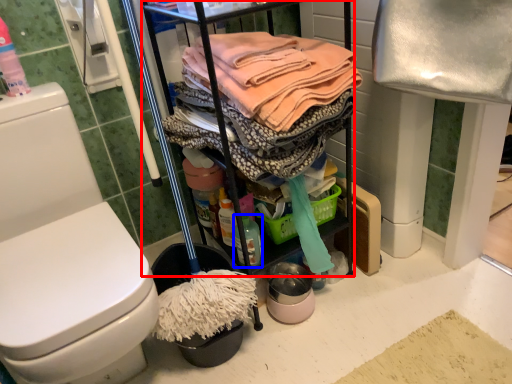
Question: Which object is further to the camera taking this photo, cabinetry (highlighted by a red box) or cleaning products (highlighted by a blue box)?

Choices:
 (A) cabinetry
 (B) cleaning products

Answer: (B)